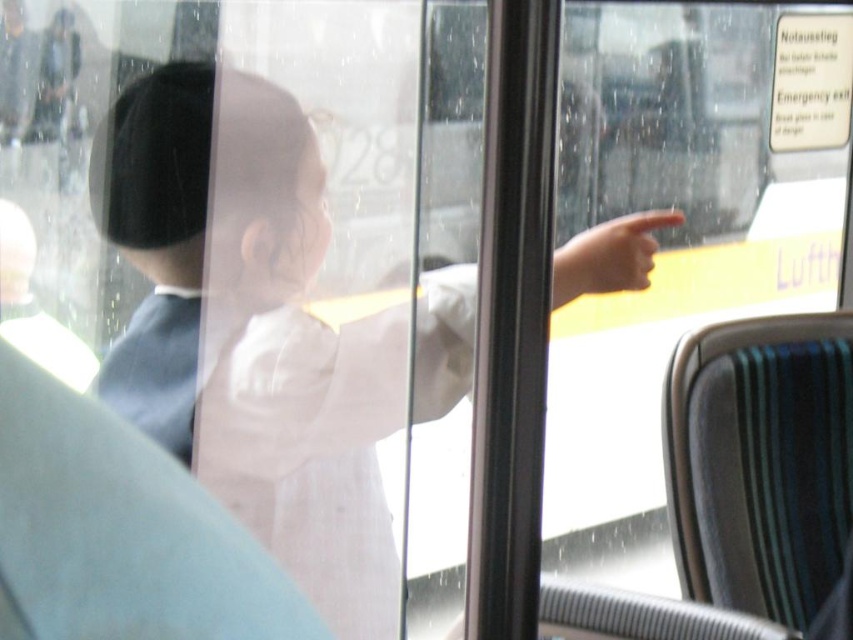
Question: Is white cloth at center further to the viewer compared to smooth skin hand at center?

Choices:
 (A) no
 (B) yes

Answer: (A)

Question: Does white cloth at center appear on the left side of smooth skin hand at center?

Choices:
 (A) no
 (B) yes

Answer: (B)

Question: Is white cloth at center wider than smooth skin hand at center?

Choices:
 (A) yes
 (B) no

Answer: (A)

Question: Which point appears closest to the camera in this image?

Choices:
 (A) (558, 305)
 (B) (258, 236)

Answer: (B)

Question: Which of the following is the farthest from the observer?

Choices:
 (A) (115, 218)
 (B) (648, 250)

Answer: (B)

Question: Which point is closer to the camera?

Choices:
 (A) white cloth at center
 (B) smooth skin hand at center

Answer: (A)